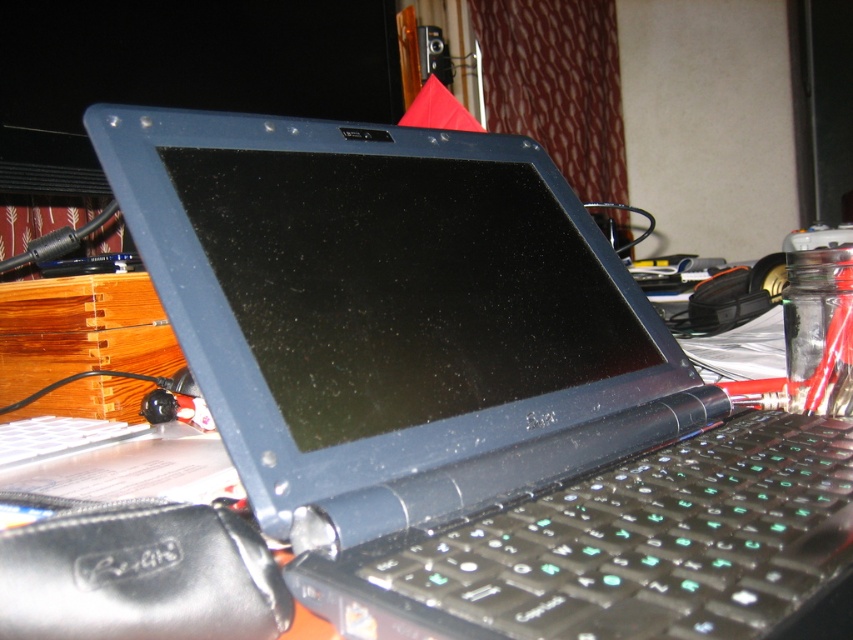
The height and width of the screenshot is (640, 853). Describe the element at coordinates (657, 541) in the screenshot. I see `black plastic keyboard at center` at that location.

Is point (786, 541) farther from viewer compared to point (0, 582)?

Yes, it is behind point (0, 582).

At what (x,y) coordinates should I click in order to perform the action: click on black plastic keyboard at center. Please return your answer as a coordinate pair (x, y). This screenshot has height=640, width=853. Looking at the image, I should click on (657, 541).

Is black leather pouch at lower left smaller than white plastic keyboard at lower left?

Yes, black leather pouch at lower left is smaller than white plastic keyboard at lower left.

Measure the distance from black leather pouch at lower left to white plastic keyboard at lower left.

They are 12.38 inches apart.

Who is more forward, (74, 582) or (80, 444)?

Point (74, 582) is in front.

At what (x,y) coordinates should I click in order to perform the action: click on black leather pouch at lower left. Please return your answer as a coordinate pair (x, y). The image size is (853, 640). Looking at the image, I should click on (140, 576).

Between black plastic keyboard at center and white plastic keyboard at lower left, which one has less height?

Standing shorter between the two is white plastic keyboard at lower left.

Which is below, black plastic keyboard at center or white plastic keyboard at lower left?

white plastic keyboard at lower left

Is point (849, 612) positioned behind point (61, 429)?

No.

Image resolution: width=853 pixels, height=640 pixels. I want to click on black plastic keyboard at center, so click(657, 541).